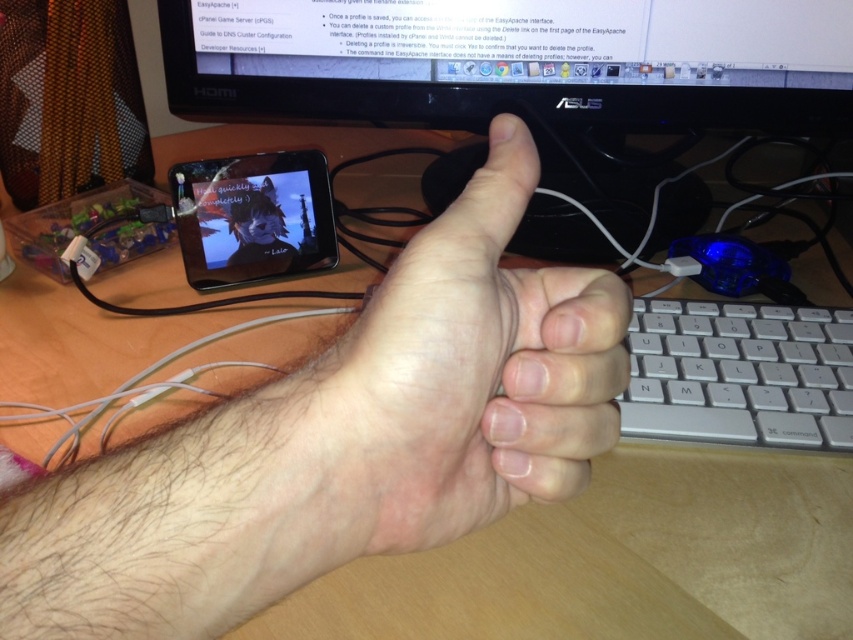
Does point (824, 376) come behind point (260, 244)?

No, it is not.

Does silver metallic keyboard at right come behind matte black tablet at center?

No, it is in front of matte black tablet at center.

The height and width of the screenshot is (640, 853). What are the coordinates of `silver metallic keyboard at right` in the screenshot? It's located at (740, 374).

Identify the location of silver metallic keyboard at right. (740, 374).

Where is `skinny flesh at center`? skinny flesh at center is located at coordinates (465, 378).

Does skinny flesh at center appear over matte black tablet at center?

No, skinny flesh at center is not above matte black tablet at center.

Who is more distant from viewer, (398, 513) or (231, 257)?

The point (231, 257) is more distant.

Where is `skinny flesh at center`? The width and height of the screenshot is (853, 640). skinny flesh at center is located at coordinates point(465,378).

Which of these two, black plastic monitor at upper center or silver metallic keyboard at right, stands shorter?

With less height is silver metallic keyboard at right.

How much distance is there between black plastic monitor at upper center and silver metallic keyboard at right?

A distance of 8.82 inches exists between black plastic monitor at upper center and silver metallic keyboard at right.

This screenshot has height=640, width=853. In order to click on black plastic monitor at upper center in this screenshot , I will do `click(520, 72)`.